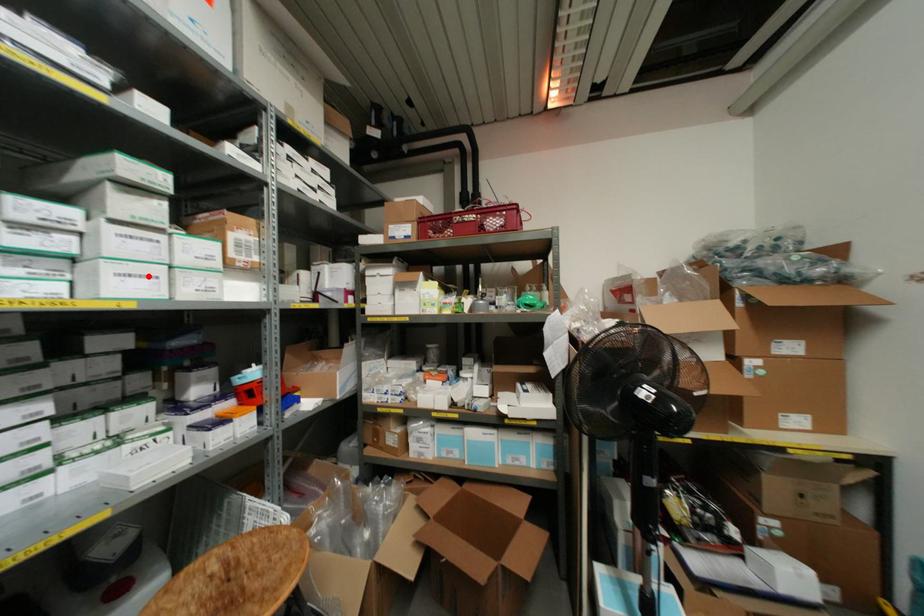
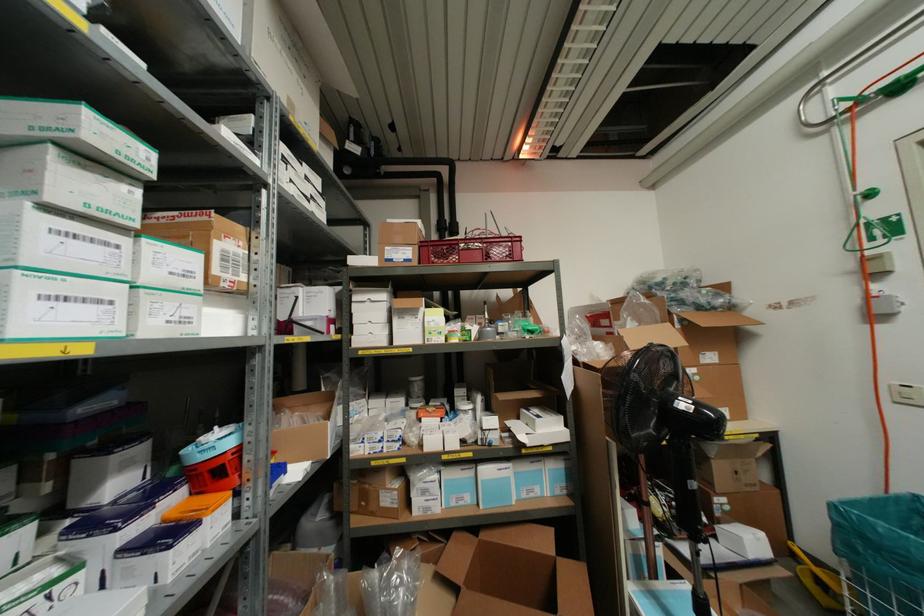
Find the pixel in the second image that matches the highlighted location in the first image.

(98, 301)